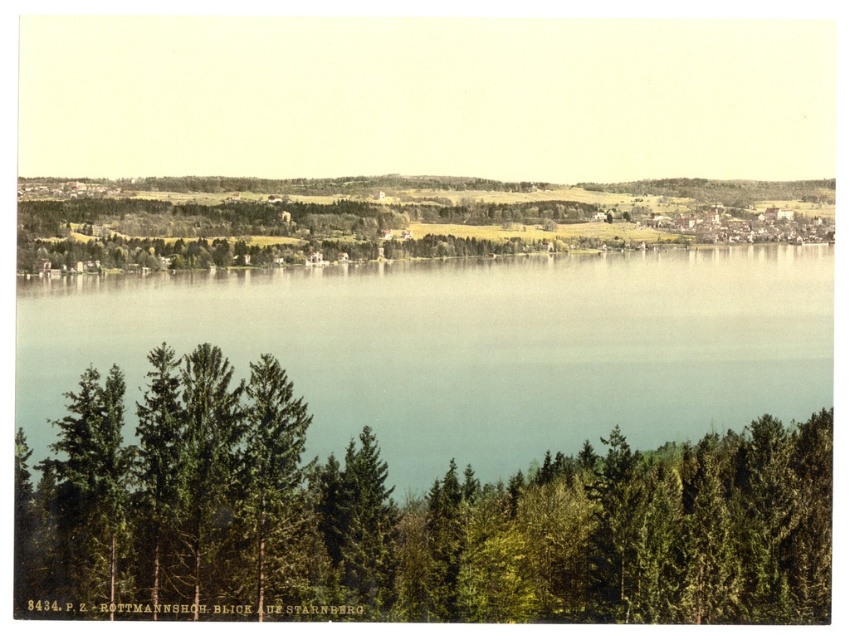
Question: Is green textured trees at lower center bigger than clear blue water at center?

Choices:
 (A) no
 (B) yes

Answer: (A)

Question: Which object appears closest to the camera in this image?

Choices:
 (A) clear blue water at center
 (B) green textured trees at lower center

Answer: (B)

Question: Among these objects, which one is farthest from the camera?

Choices:
 (A) clear blue water at center
 (B) green textured trees at lower center

Answer: (A)

Question: Is green textured trees at lower center below clear blue water at center?

Choices:
 (A) no
 (B) yes

Answer: (B)

Question: Does green textured trees at lower center have a greater width compared to clear blue water at center?

Choices:
 (A) no
 (B) yes

Answer: (A)